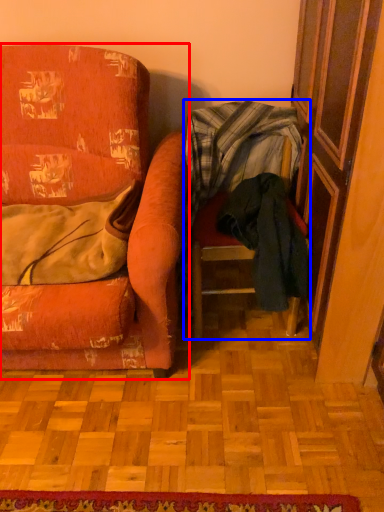
Question: Which point is further to the camera, chair (highlighted by a red box) or chair (highlighted by a blue box)?

Choices:
 (A) chair
 (B) chair

Answer: (B)